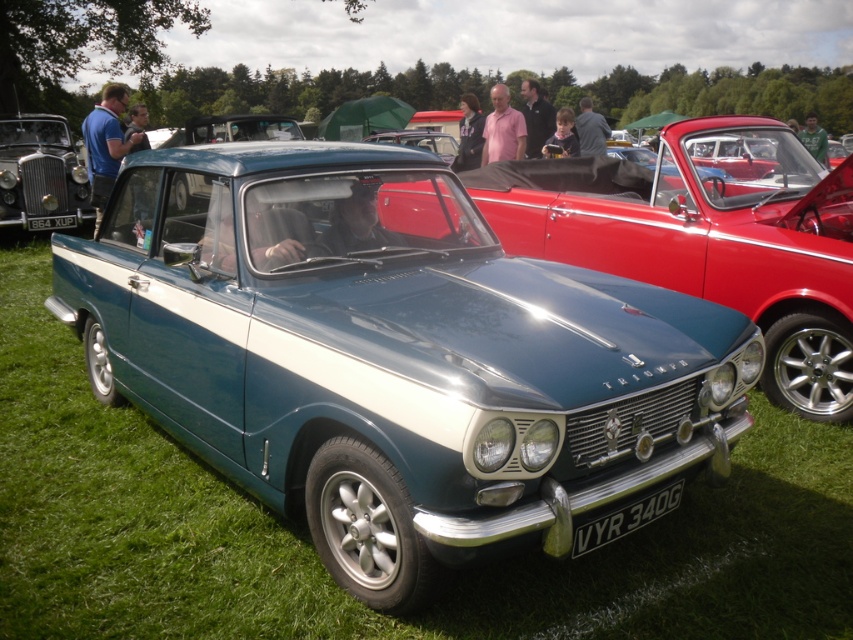
You are a photographer setting up equipment at the classic car event. You need to position your tripod so that both the matte black car at left and the black metal license plate at lower center are visible in your shot. Based on their positions, which object is higher in the frame?

The matte black car at left is above the black metal license plate at lower center, so it will appear higher in the frame.

You are a photographer setting up a tripod to capture both the metallic blue car at center and the matte black car at left. Since you want both cars to be fully visible in the frame, which car should you position closer to the camera to avoid cropping?

The metallic blue car at center is shorter than the matte black car at left, so positioning the metallic blue car at center closer to the camera will ensure both cars are fully visible without cropping.

Looking at this image, you are a photographer positioned at the edge of the field where the classic car event is happening. You want to capture a photo of the teal metallic car at center without any other cars blocking it. Given their positions, is the matte black car at left in a position that could block your shot?

The matte black car at left is to the left of the teal metallic car at center, so it would not block your shot of the teal metallic car at center as it is positioned to the side rather than in front.